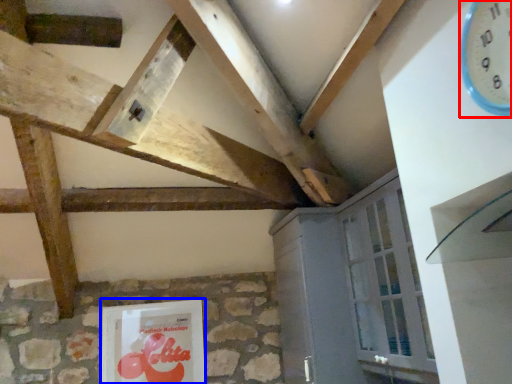
Question: Which object appears farthest to the camera in this image, clock (highlighted by a red box) or picture frame (highlighted by a blue box)?

Choices:
 (A) clock
 (B) picture frame

Answer: (B)